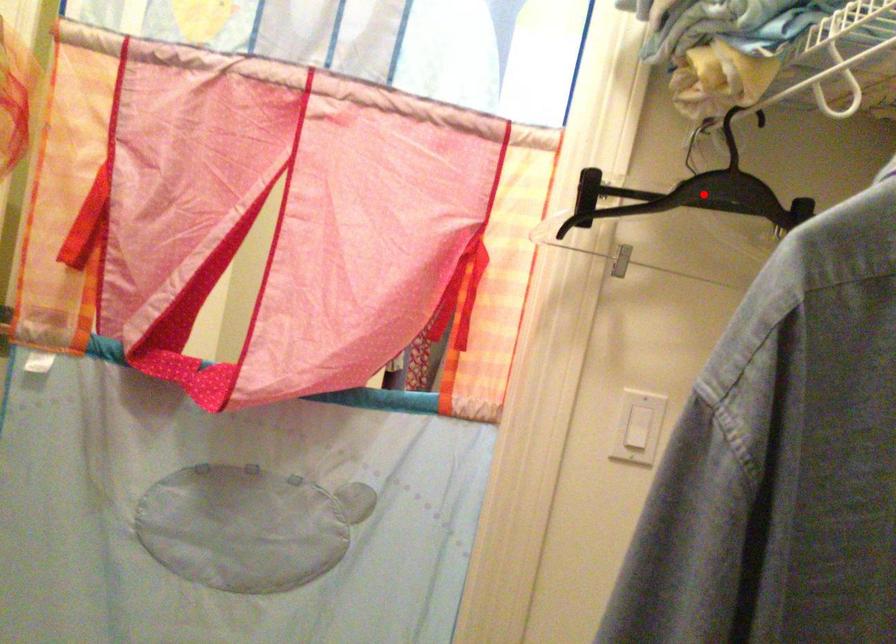
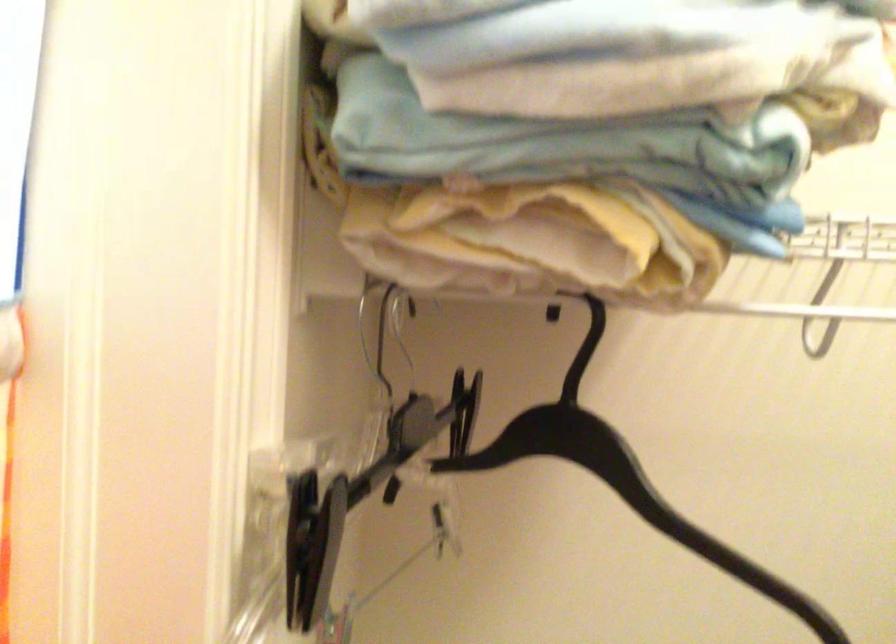
Question: I am providing you with two images of the same scene from different viewpoints. Image1 has a red point marked. In image2, the corresponding 3D location appears at what relative position? Reply with the corresponding letter.

Choices:
 (A) Closer
 (B) Farther

Answer: (A)